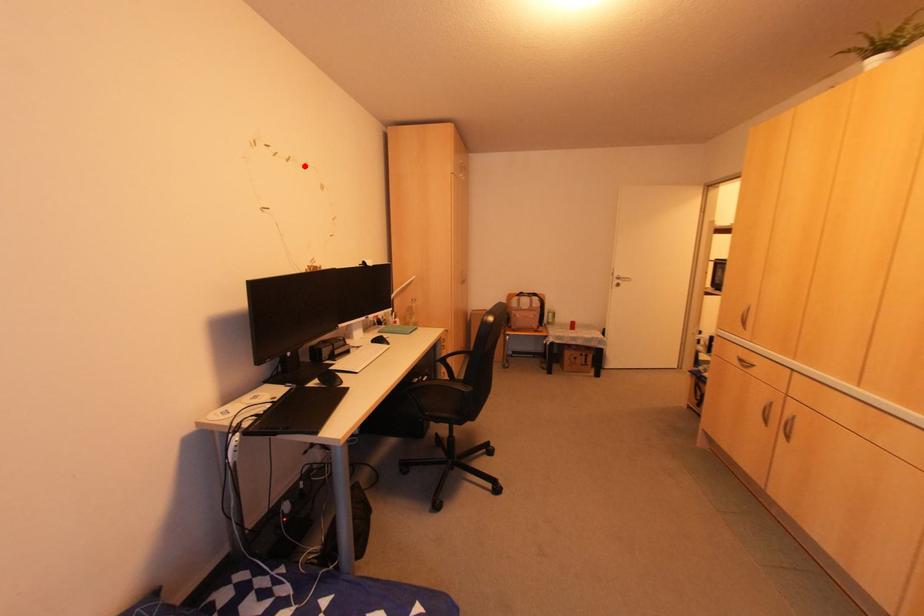
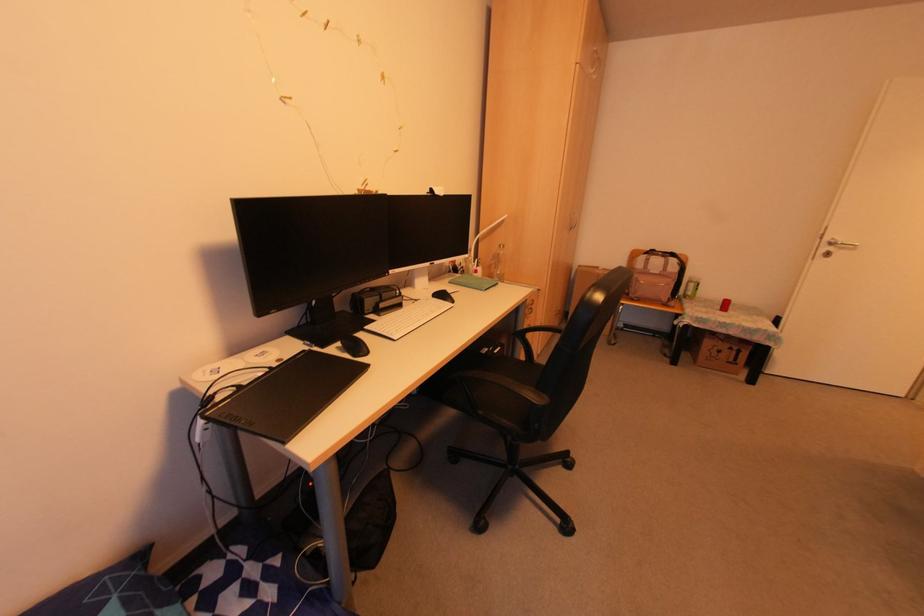
In the second image, find the point that corresponds to the highlighted location in the first image.

(358, 41)